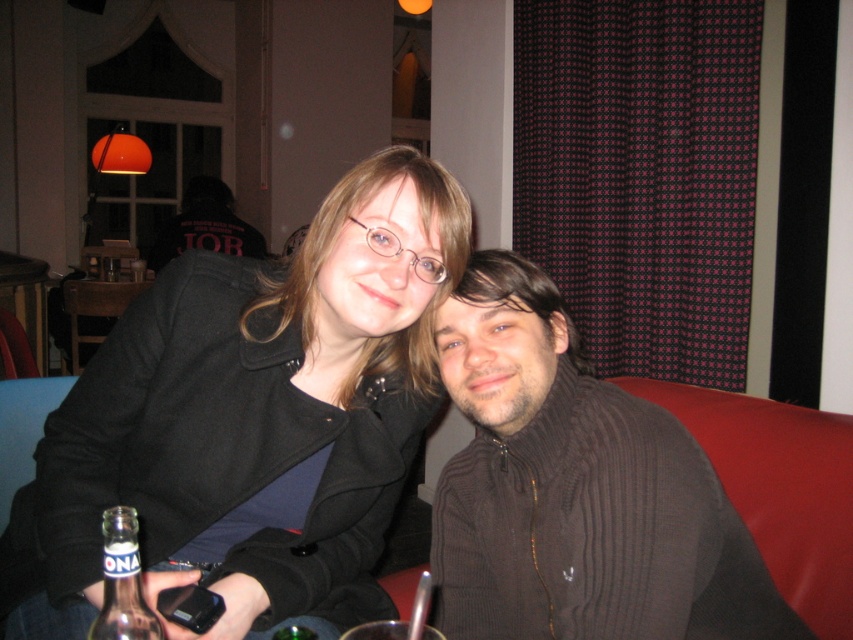
From the picture: Can you confirm if black matte jacket at upper left is positioned to the right of dark brown sweater at right?

In fact, black matte jacket at upper left is to the left of dark brown sweater at right.

Can you confirm if black matte jacket at upper left is thinner than dark brown sweater at right?

In fact, black matte jacket at upper left might be wider than dark brown sweater at right.

Does point (119, 412) come in front of point (558, 365)?

No, (119, 412) is further to viewer.

The width and height of the screenshot is (853, 640). Identify the location of black matte jacket at upper left. (259, 416).

Is black matte jacket at upper left to the left of clear glass bottle at lower left from the viewer's perspective?

Incorrect, black matte jacket at upper left is not on the left side of clear glass bottle at lower left.

This screenshot has height=640, width=853. I want to click on black matte jacket at upper left, so click(x=259, y=416).

Does dark brown sweater at right appear on the right side of clear glass bottle at lower left?

Correct, you'll find dark brown sweater at right to the right of clear glass bottle at lower left.

Describe the element at coordinates (576, 490) in the screenshot. The height and width of the screenshot is (640, 853). I see `dark brown sweater at right` at that location.

You are a GUI agent. You are given a task and a screenshot of the screen. Output one action in this format:
    pyautogui.click(x=<x>, y=<y>)
    Task: Click on the dark brown sweater at right
    
    Given the screenshot: What is the action you would take?
    pyautogui.click(x=576, y=490)